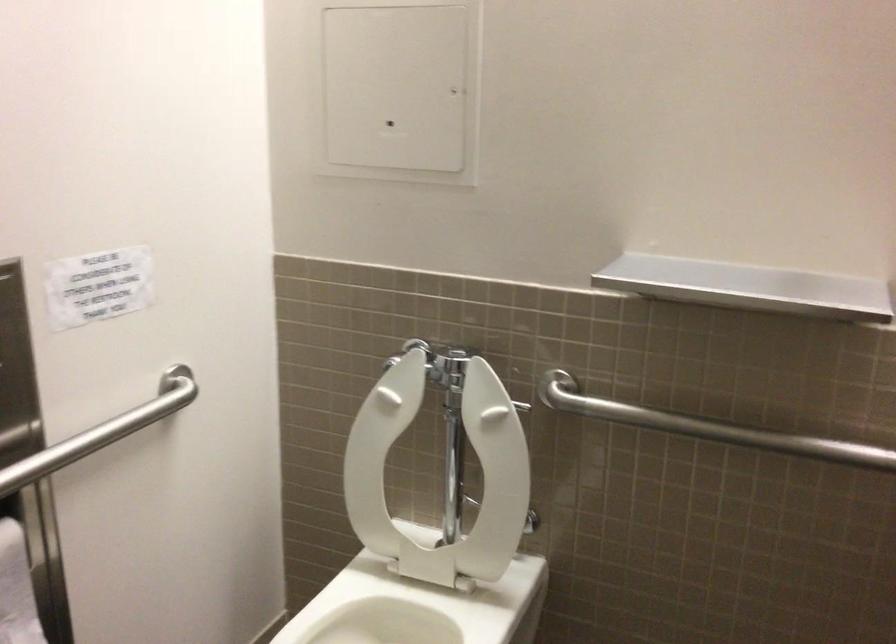
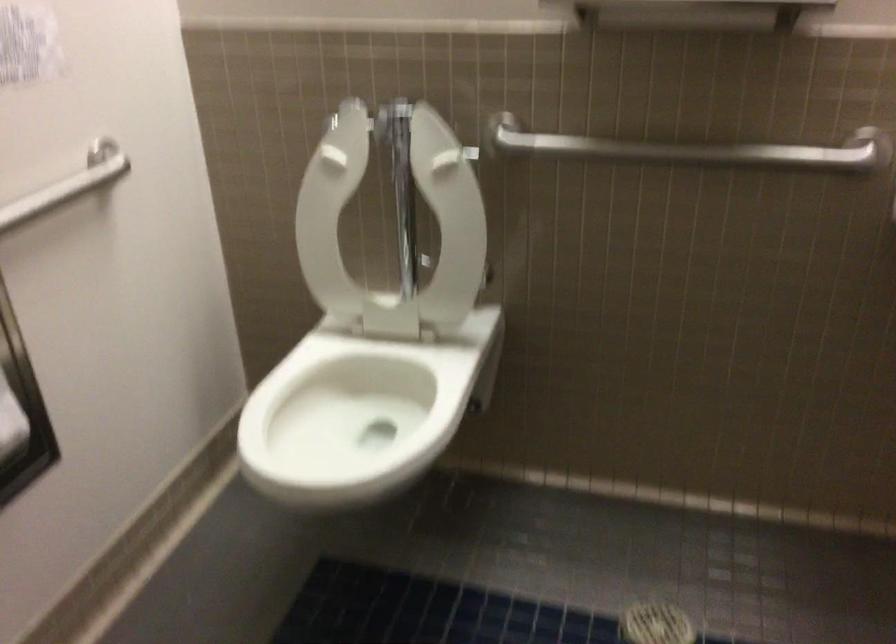
Question: The images are taken continuously from a first-person perspective. In which direction is your viewpoint rotating?

Choices:
 (A) Left
 (B) Right
 (C) Up
 (D) Down

Answer: (D)